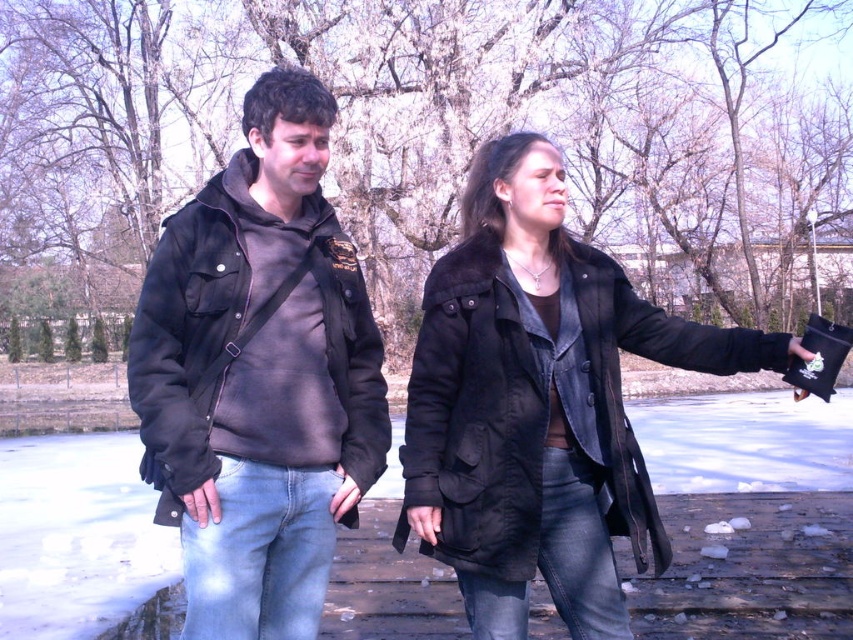
Question: Does matte black jacket at left appear on the left side of matte black coat at center?

Choices:
 (A) no
 (B) yes

Answer: (B)

Question: Which point is farther to the camera?

Choices:
 (A) (578, 448)
 (B) (289, 161)

Answer: (A)

Question: Is matte black jacket at left below matte black coat at center?

Choices:
 (A) yes
 (B) no

Answer: (B)

Question: Which point is closer to the camera?

Choices:
 (A) matte black coat at center
 (B) matte black jacket at left

Answer: (B)

Question: Is matte black jacket at left bigger than matte black coat at center?

Choices:
 (A) no
 (B) yes

Answer: (A)